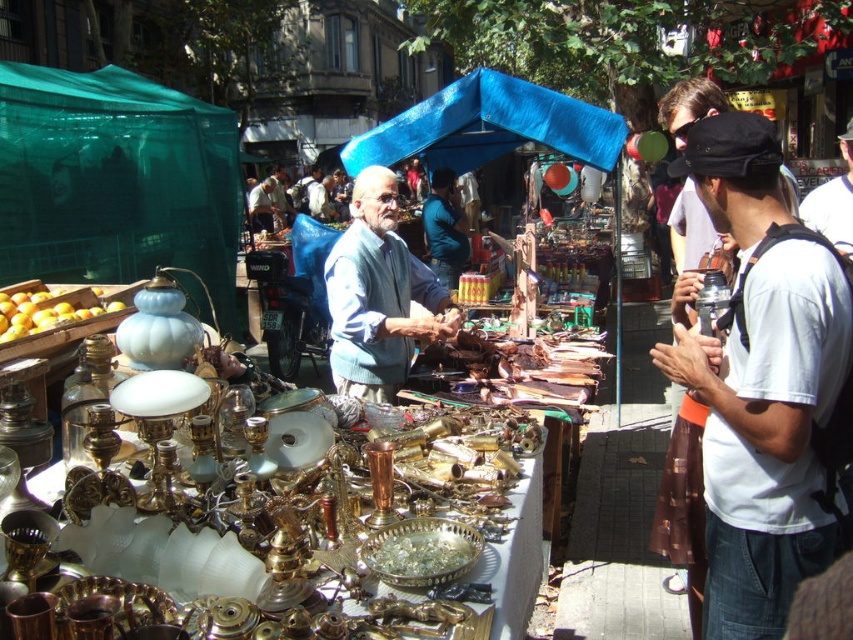
Between point (685, 157) and point (431, 216), which one is positioned in front?

Point (685, 157) is in front.

Is point (834, 321) behind point (442, 284)?

That is False.

Image resolution: width=853 pixels, height=640 pixels. What are the coordinates of `black fabric cap at upper right` in the screenshot? It's located at (762, 384).

Who is more forward, (392, 288) or (434, 234)?

Point (392, 288) is more forward.

Does blue cotton shirt at center have a lesser height compared to blue fabric jacket at center?

Indeed, blue cotton shirt at center has a lesser height compared to blue fabric jacket at center.

Does point (343, 260) come farther from viewer compared to point (426, 195)?

No.

You are a GUI agent. You are given a task and a screenshot of the screen. Output one action in this format:
    pyautogui.click(x=<x>, y=<y>)
    Task: Click on the blue cotton shirt at center
    
    Given the screenshot: What is the action you would take?
    pyautogui.click(x=379, y=296)

Between point (840, 292) and point (370, 304), which one is positioned behind?

The point (370, 304) is more distant.

Does black fabric cap at upper right appear on the left side of blue cotton shirt at center?

No, black fabric cap at upper right is not to the left of blue cotton shirt at center.

Who is more forward, (798, 378) or (360, 314)?

Point (798, 378)

Locate an element on the screen. black fabric cap at upper right is located at coordinates (762, 384).